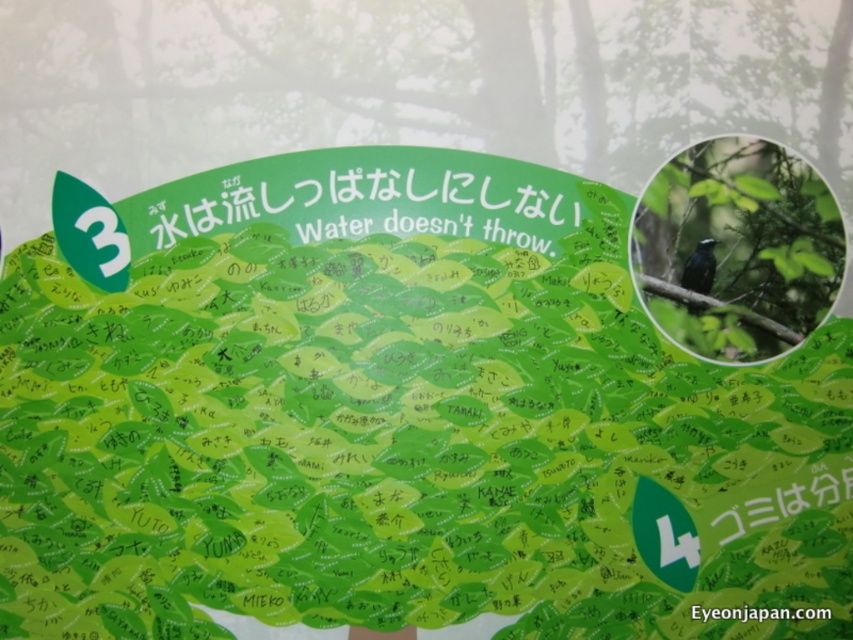
Between green leafy tree at upper right and shiny black bird at upper right, which one appears on the left side from the viewer's perspective?

Positioned to the left is green leafy tree at upper right.

Between green leafy tree at upper right and shiny black bird at upper right, which one has less height?

Standing shorter between the two is shiny black bird at upper right.

Where is `green leafy tree at upper right`? green leafy tree at upper right is located at coordinates (408, 84).

Identify the location of green leafy tree at upper right. (408, 84).